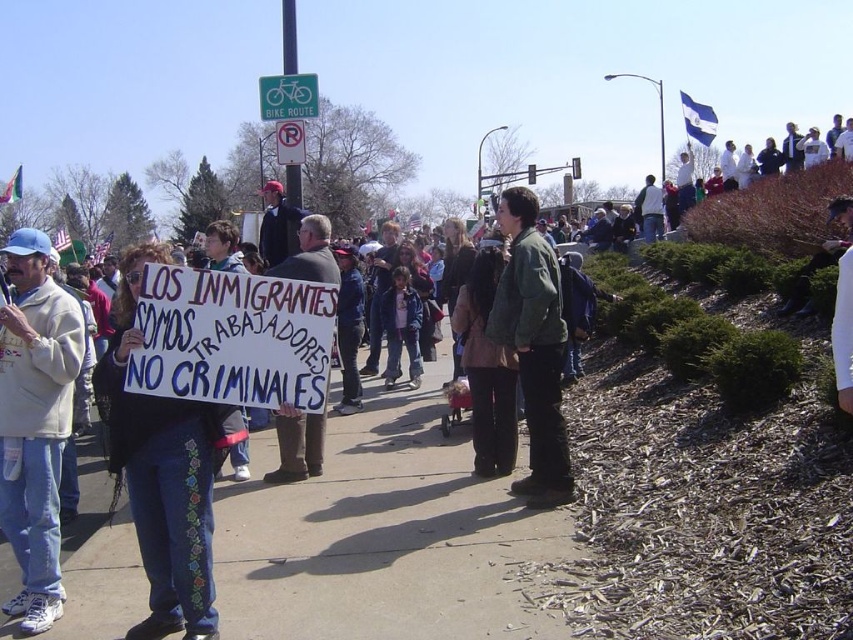
Question: Estimate the real-world distances between objects in this image. Which object is closer to the white fleece sweatshirt at center?

Choices:
 (A) white paper sign at center
 (B) green plastic bike route at upper center

Answer: (A)

Question: Can you confirm if green fuzzy jacket at center is positioned below white paper sign at center?

Choices:
 (A) yes
 (B) no

Answer: (B)

Question: Does white fleece sweatshirt at center have a lesser width compared to green fuzzy jacket at center?

Choices:
 (A) no
 (B) yes

Answer: (B)

Question: Is white paper sign at center thinner than green plastic bike route at upper center?

Choices:
 (A) no
 (B) yes

Answer: (B)

Question: Which of these objects is positioned farthest from the white paper sign at center?

Choices:
 (A) white fleece sweatshirt at center
 (B) green fuzzy jacket at center

Answer: (A)

Question: Which of the following is the closest to the observer?

Choices:
 (A) (315, 109)
 (B) (502, 333)

Answer: (B)